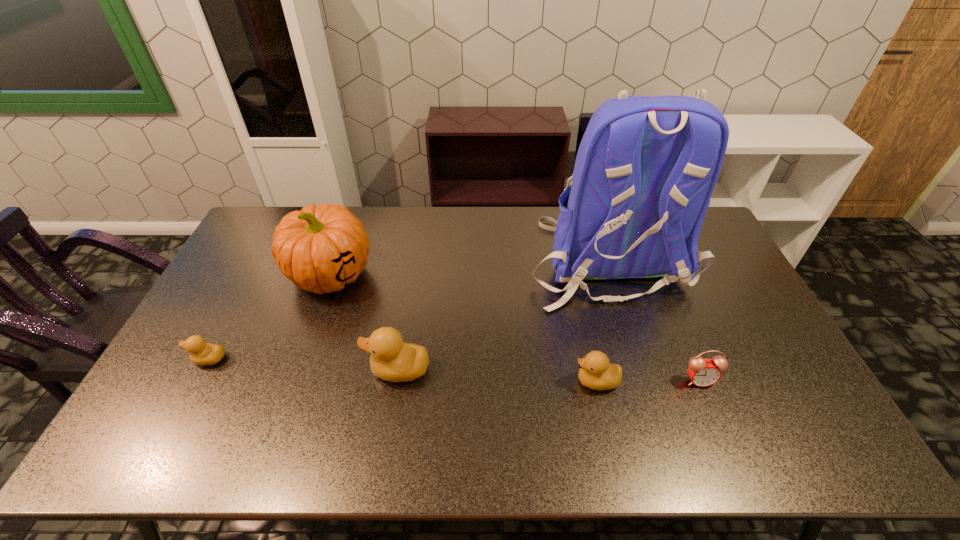
Please point a spot to add another duckling on the right. Please provide its 2D coordinates. Your answer should be formatted as a tuple, i.e. [(x, y)], where the tuple contains the x and y coordinates of a point satisfying the conditions above.

[(803, 393)]